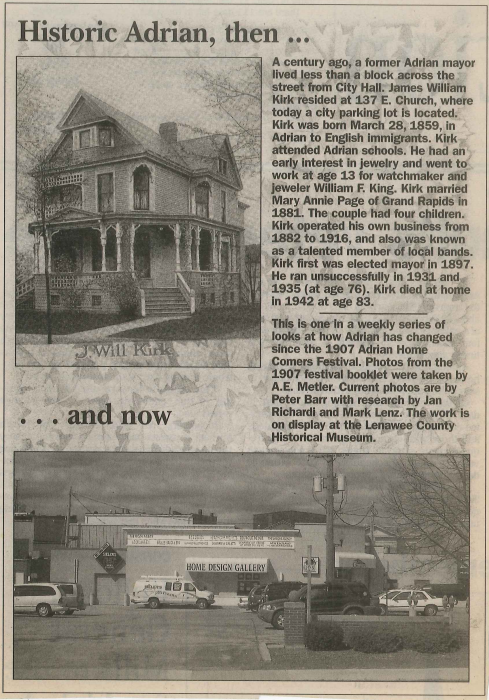
This screenshot has height=700, width=489. Identify the location of windows. (137, 187), (109, 195).